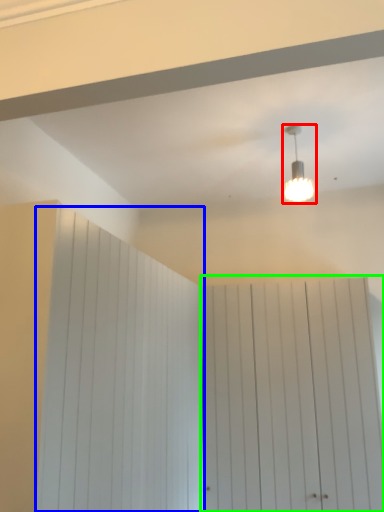
Question: Based on their relative distances, which object is farther from lamp (highlighted by a red box)? Choose from barn door (highlighted by a blue box) and barn door (highlighted by a green box).

Choices:
 (A) barn door
 (B) barn door

Answer: (A)